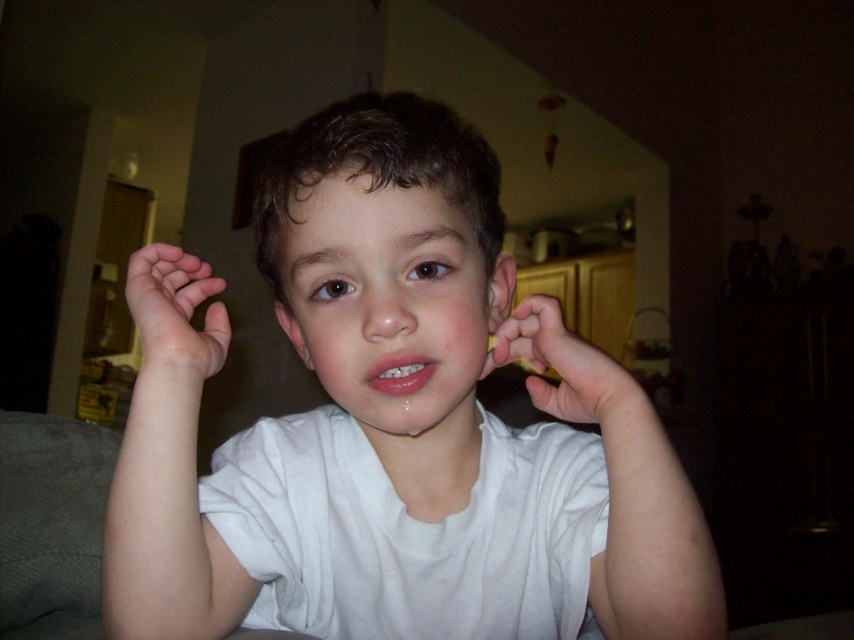
Question: Considering the real-world distances, which object is closest to the white cotton shirt at center?

Choices:
 (A) matte white ear at center
 (B) skinny flesh at left
 (C) smooth skin ear at center

Answer: (A)

Question: Which point appears farthest from the camera in this image?

Choices:
 (A) (354, 164)
 (B) (537, 406)
 (C) (282, 321)
 (D) (506, 268)

Answer: (C)

Question: Is smooth skin ear at center smaller than matte white ear at center?

Choices:
 (A) yes
 (B) no

Answer: (A)

Question: Is skinny flesh at left thinner than matte white ear at center?

Choices:
 (A) yes
 (B) no

Answer: (B)

Question: Which object appears farthest from the camera in this image?

Choices:
 (A) white matte hand at center
 (B) smooth skin ear at center
 (C) white cotton shirt at center
 (D) matte white ear at center

Answer: (B)

Question: Does skinny flesh at left appear on the left side of smooth skin ear at center?

Choices:
 (A) no
 (B) yes

Answer: (B)